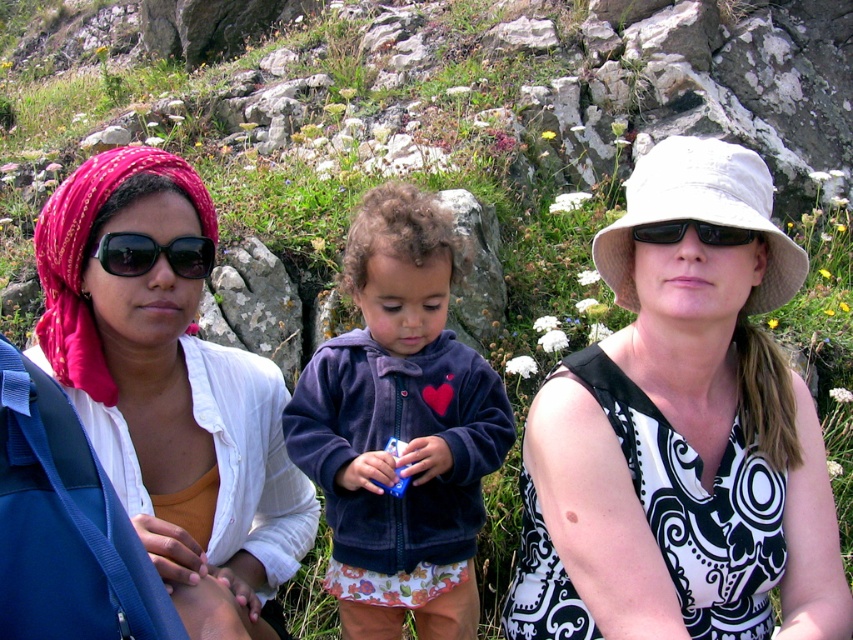
Question: Which point is closer to the camera?

Choices:
 (A) velvet purple jacket at center
 (B) matte pink headscarf at left
 (C) black plastic sunglasses at right

Answer: (B)

Question: Which of the following is the closest to the observer?

Choices:
 (A) (466, 486)
 (B) (787, 536)
 (C) (201, 531)

Answer: (C)

Question: Can you confirm if white printed dress at center is thinner than black plastic sunglasses at right?

Choices:
 (A) no
 (B) yes

Answer: (A)

Question: Is matte black sunglasses at left above black plastic sunglasses at right?

Choices:
 (A) yes
 (B) no

Answer: (B)

Question: In this image, where is white printed dress at center located relative to velvet purple jacket at center?

Choices:
 (A) below
 (B) above

Answer: (B)

Question: Which point is closer to the camera taking this photo?

Choices:
 (A) (404, 305)
 (B) (730, 227)

Answer: (B)